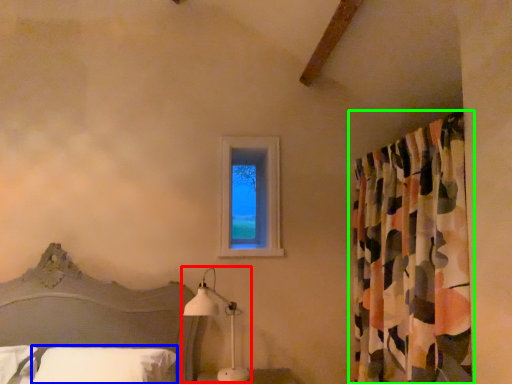
Question: Based on their relative distances, which object is nearer to table lamp (highlighted by a red box)? Choose from pillow (highlighted by a blue box) and curtain (highlighted by a green box).

Choices:
 (A) pillow
 (B) curtain

Answer: (A)